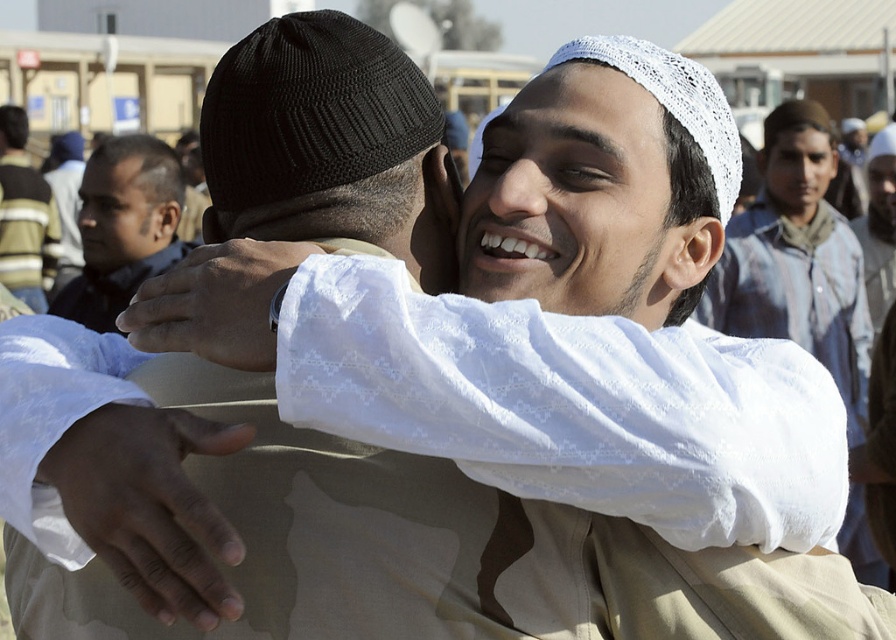
You are an observer at the event and notice the white lace shirt at upper center and the brown leather jacket at left. Which clothing item is covering part of the other?

The white lace shirt at upper center is positioned over the brown leather jacket at left, so it is covering part of it.